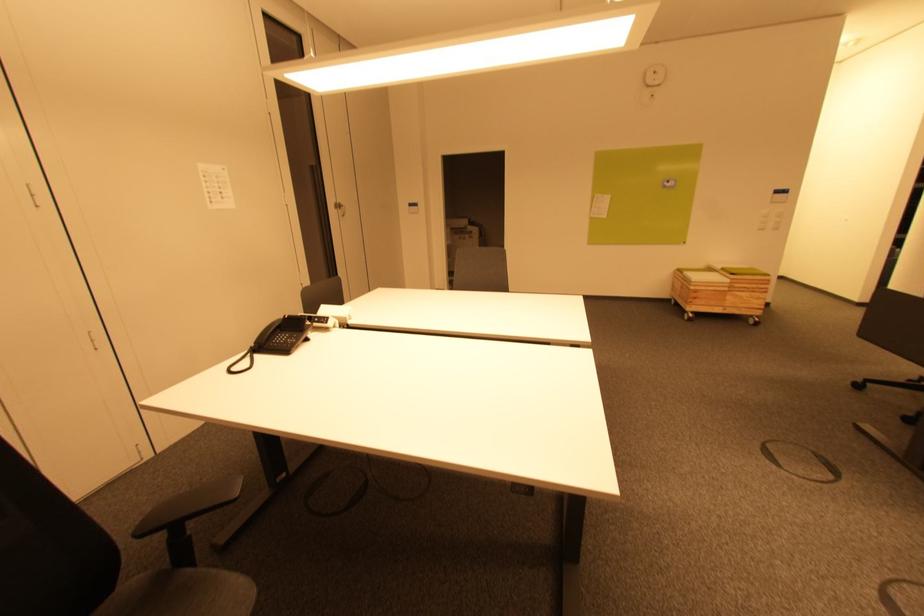
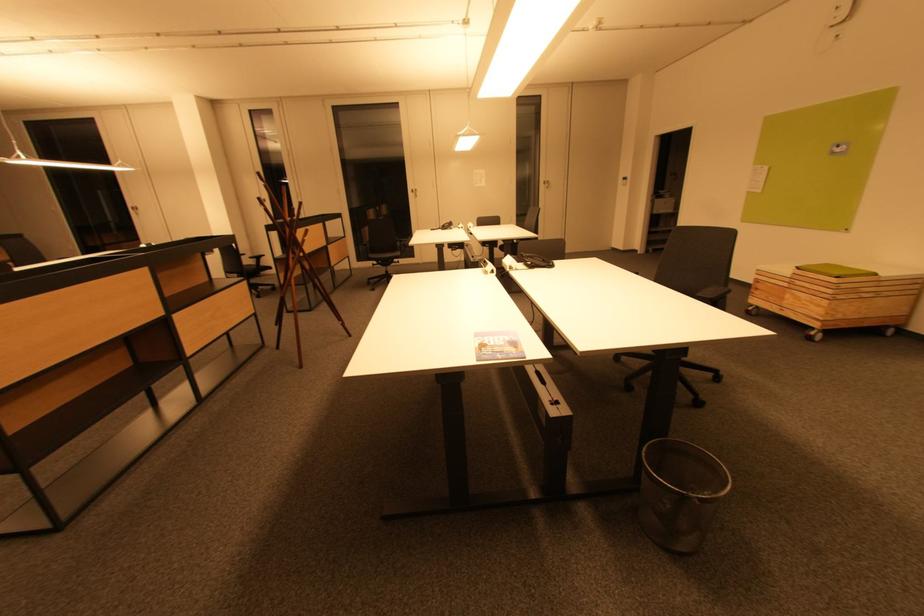
Where in the second image is the point corresponding to [756,300] from the first image?

(816, 305)